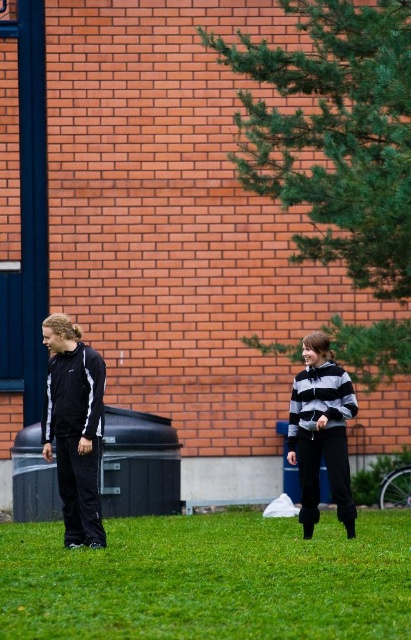
Between green grass at lower center and matte black tracksuit at left, which one appears on the right side from the viewer's perspective?

green grass at lower center

Which of these two, green grass at lower center or matte black tracksuit at left, stands taller?

Standing taller between the two is matte black tracksuit at left.

Who is more distant from viewer, (147,576) or (62,499)?

Positioned behind is point (62,499).

Identify the location of green grass at lower center. (209, 580).

Who is positioned more to the right, matte black tracksuit at left or striped hoodie at center?

Positioned to the right is striped hoodie at center.

Is matte black tracksuit at left positioned in front of striped hoodie at center?

Yes.

Based on the photo, who is more distant from viewer, (71,384) or (336,416)?

Point (336,416)

Identify the location of matte black tracksuit at left. The width and height of the screenshot is (411, 640). (74, 428).

Between green grass at lower center and striped hoodie at center, which one is positioned lower?

green grass at lower center

The width and height of the screenshot is (411, 640). What do you see at coordinates (209, 580) in the screenshot?
I see `green grass at lower center` at bounding box center [209, 580].

You are a GUI agent. You are given a task and a screenshot of the screen. Output one action in this format:
    pyautogui.click(x=<x>, y=<y>)
    Task: Click on the green grass at lower center
    
    Given the screenshot: What is the action you would take?
    pyautogui.click(x=209, y=580)